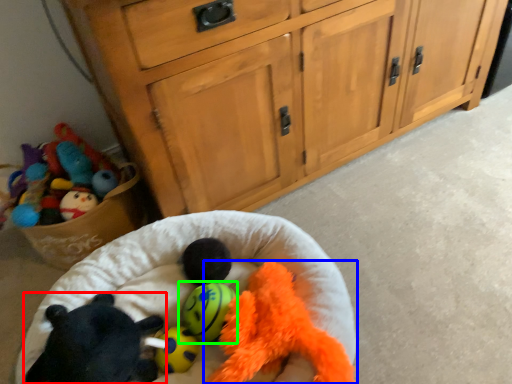
Question: Estimate the real-world distances between objects in this image. Which object is farther from toy (highlighted by a red box), toy (highlighted by a blue box) or toy (highlighted by a green box)?

Choices:
 (A) toy
 (B) toy

Answer: (A)